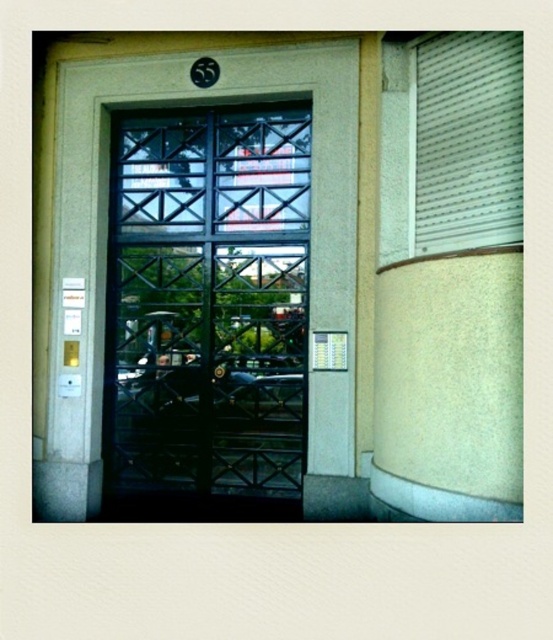
Does black metal/glass door at center have a smaller size compared to beige textured pillar at right?

No.

Can you confirm if black metal/glass door at center is taller than beige textured pillar at right?

Yes.

Which is in front, point (128, 163) or point (430, 234)?

Point (430, 234) is in front.

The height and width of the screenshot is (640, 553). I want to click on black metal/glass door at center, so click(207, 314).

From the picture: Is beige textured pillar at right taller than white plastic blinds at right?

Correct, beige textured pillar at right is much taller as white plastic blinds at right.

Measure the distance between beige textured pillar at right and camera.

beige textured pillar at right is 3.28 meters from camera.

Is point (405, 436) closer to camera compared to point (500, 67)?

Yes, it is.

Image resolution: width=553 pixels, height=640 pixels. Identify the location of beige textured pillar at right. (451, 282).

From the picture: Who is positioned more to the left, black metal/glass door at center or white plastic blinds at right?

black metal/glass door at center

Is black metal/glass door at center smaller than white plastic blinds at right?

No.

The image size is (553, 640). Identify the location of black metal/glass door at center. (207, 314).